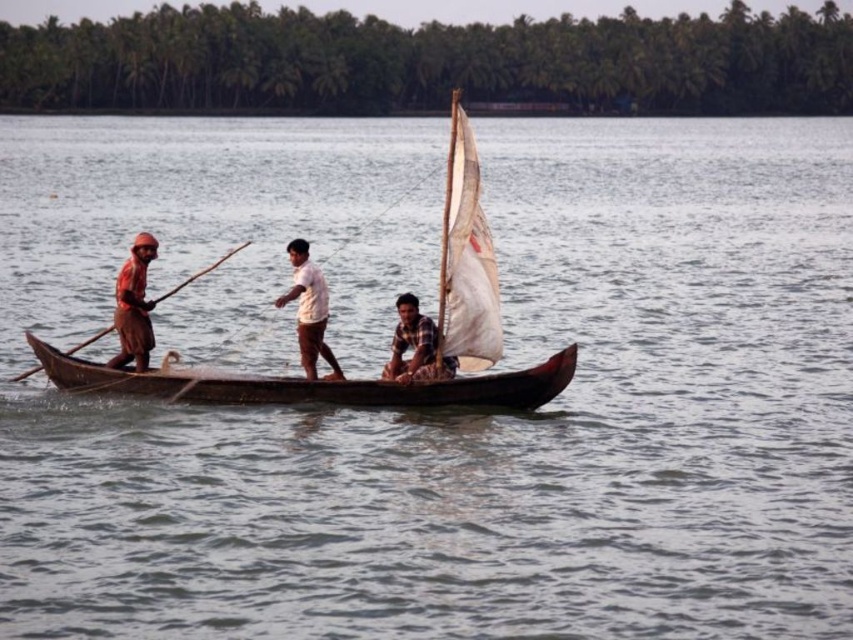
Question: Is wooden canoe at center thinner than wooden paddle at left?

Choices:
 (A) no
 (B) yes

Answer: (A)

Question: Can you confirm if matte orange shirt at left is thinner than white cotton shirt at center?

Choices:
 (A) no
 (B) yes

Answer: (A)

Question: Which of the following is the closest to the observer?

Choices:
 (A) (344, 381)
 (B) (401, 349)
 (C) (68, 368)
 (D) (312, 355)

Answer: (A)

Question: Which object is closer to the camera taking this photo?

Choices:
 (A) wooden sailboat at center
 (B) wooden canoe at center
 (C) wooden paddle at left

Answer: (A)

Question: Can you confirm if matte orange shirt at left is positioned below wooden paddle at left?

Choices:
 (A) yes
 (B) no

Answer: (B)

Question: Which is farther from the white cotton shirt at center?

Choices:
 (A) wooden paddle at left
 (B) checkered fabric shirt at center

Answer: (A)